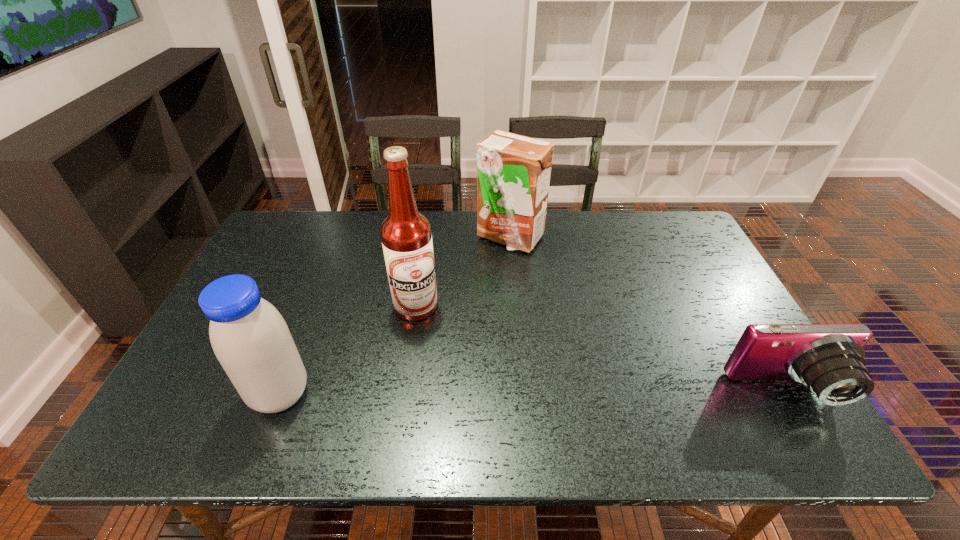
Locate an element on the screen. This screenshot has height=540, width=960. the leftmost object is located at coordinates (251, 340).

Locate an element on the screen. The height and width of the screenshot is (540, 960). the shortest object is located at coordinates (827, 358).

Where is `camera`? camera is located at coordinates (827, 358).

Image resolution: width=960 pixels, height=540 pixels. I want to click on the third nearest object, so click(x=406, y=237).

Where is `the second object from left to right`? The height and width of the screenshot is (540, 960). the second object from left to right is located at coordinates (406, 237).

Where is `the farthest object`? This screenshot has height=540, width=960. the farthest object is located at coordinates (513, 171).

Where is `carton`? The height and width of the screenshot is (540, 960). carton is located at coordinates (513, 171).

The height and width of the screenshot is (540, 960). In order to click on vacant region located on the right of the soya milk in this screenshot , I will do `click(411, 394)`.

At what (x,y) coordinates should I click in order to perform the action: click on vacant space positioned 0.330m on the label side of the second farthest object. Please return your answer as a coordinate pair (x, y). The image size is (960, 540). Looking at the image, I should click on (516, 400).

You are a GUI agent. You are given a task and a screenshot of the screen. Output one action in this format:
    pyautogui.click(x=<x>, y=<y>)
    Task: Click on the blank space located 0.210m on the label side of the second farthest object
    
    Given the screenshot: What is the action you would take?
    pyautogui.click(x=481, y=367)